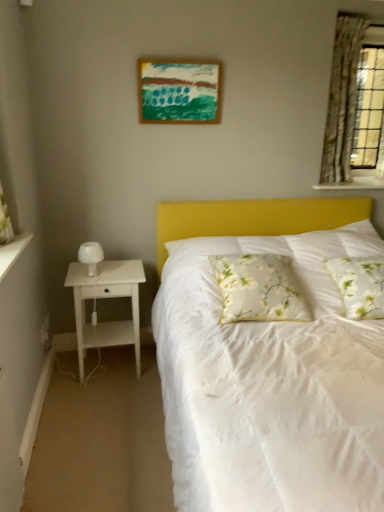
What are the coordinates of `free spot in front of white wood nightstand at left` in the screenshot? It's located at coord(110,411).